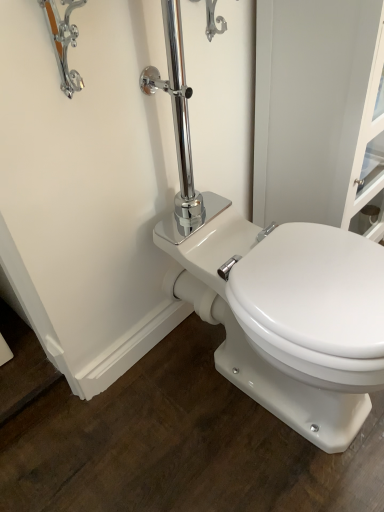
Image resolution: width=384 pixels, height=512 pixels. I want to click on vacant space to the left of white glossy porcelain toilet at center, so click(x=134, y=433).